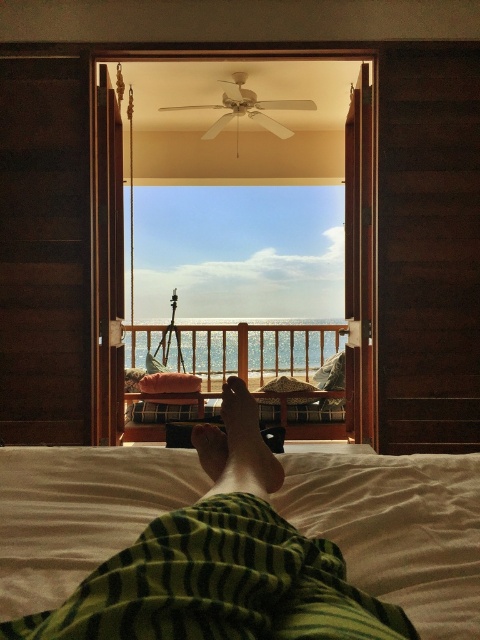
You are lying on the white soft bed at lower center and want to look through the transparent glass door at center. Can you see the door from your current position on the bed?

The transparent glass door at center is positioned over the white soft bed at lower center, so yes, you can see the door from your current position on the bed.

You are lying on the white soft bed at lower center. If you look towards the ceiling, which direction would you face?

Since you are lying on the white soft bed at lower center, facing the ceiling would mean looking upwards, away from the bed.